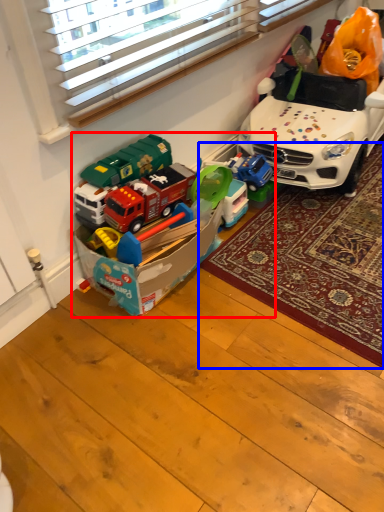
Question: Among these objects, which one is nearest to the camera, toy (highlighted by a red box) or mat (highlighted by a blue box)?

Choices:
 (A) toy
 (B) mat

Answer: (A)